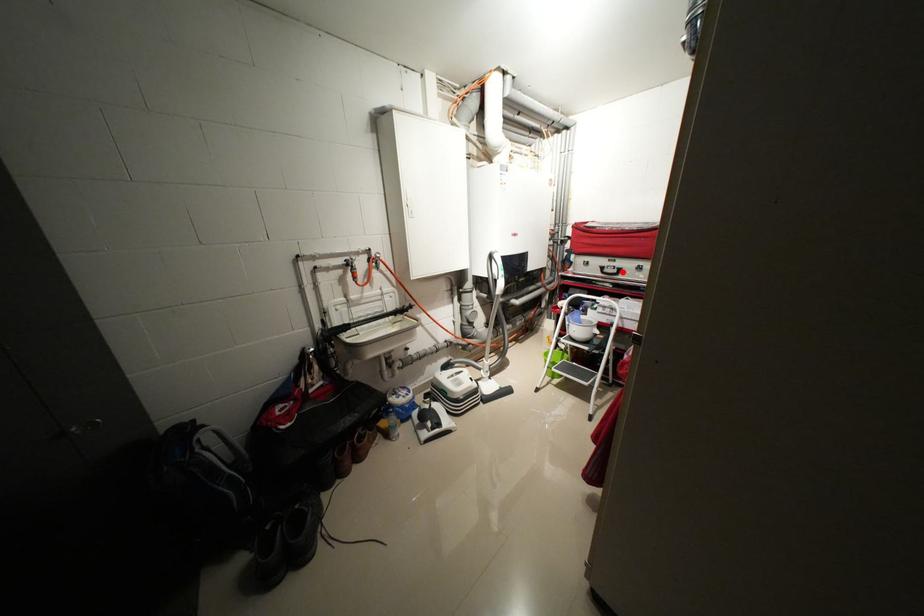
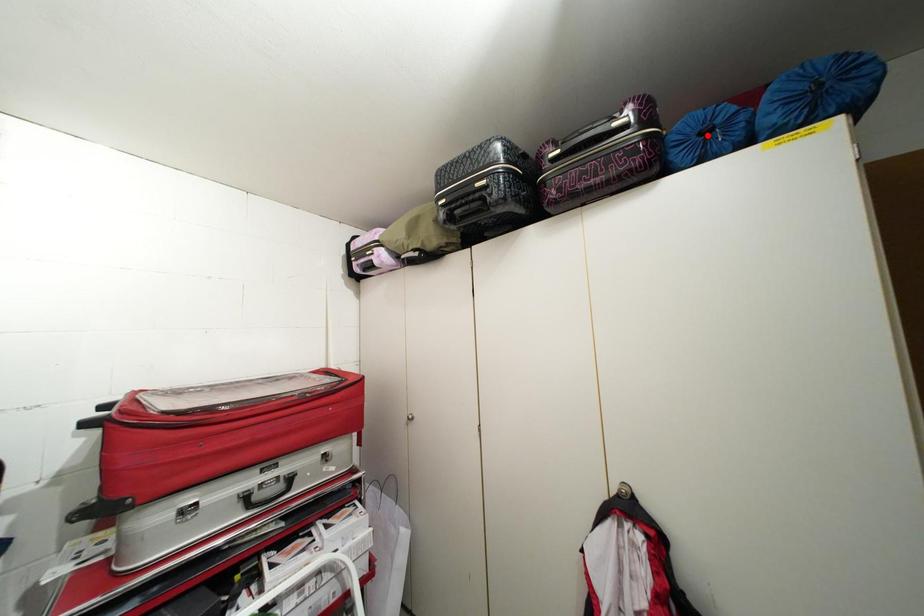
I am providing you with two images of the same scene from different viewpoints. A red point is marked on the first image and another point is marked on the second image. Is the marked point in image1 the same physical position as the marked point in image2?

No